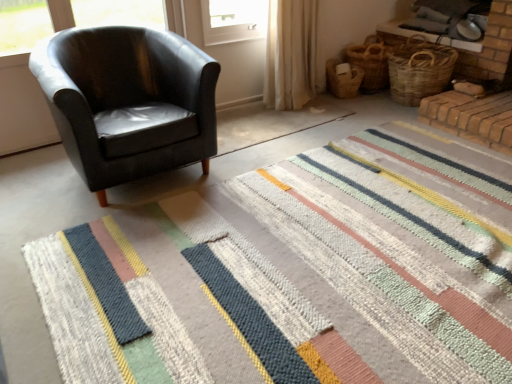
Locate an element on the screen. This screenshot has height=384, width=512. free location to the left of woven brown basket at upper right, marked as the third basket in a left-to-right arrangement is located at coordinates (366, 112).